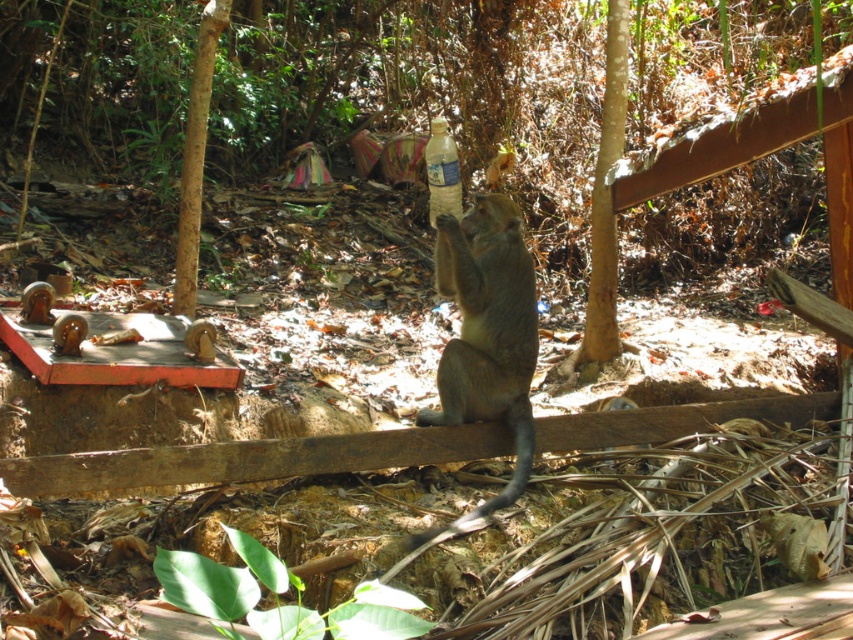
Is brown furry monkey at center shorter than translucent plastic bottle at center?

No, brown furry monkey at center is not shorter than translucent plastic bottle at center.

Between brown furry monkey at center and translucent plastic bottle at center, which one has less height?

translucent plastic bottle at center is shorter.

Is point (517, 259) behind point (448, 179)?

No, (517, 259) is in front of (448, 179).

The image size is (853, 640). I want to click on brown furry monkey at center, so click(486, 336).

Can you confirm if brown rough bark tree at center is positioned below translucent plastic bottle at center?

Correct, brown rough bark tree at center is located below translucent plastic bottle at center.

Does point (585, 353) come in front of point (456, 163)?

Yes, point (585, 353) is closer to viewer.

The width and height of the screenshot is (853, 640). In order to click on brown rough bark tree at center in this screenshot , I will do `click(606, 200)`.

Locate an element on the screen. brown rough bark tree at center is located at coordinates (606, 200).

Between point (535, 340) and point (605, 348), which one is positioned in front?

Positioned in front is point (535, 340).

Does brown furry monkey at center have a greater width compared to brown rough bark tree at center?

Correct, the width of brown furry monkey at center exceeds that of brown rough bark tree at center.

I want to click on brown furry monkey at center, so click(x=486, y=336).